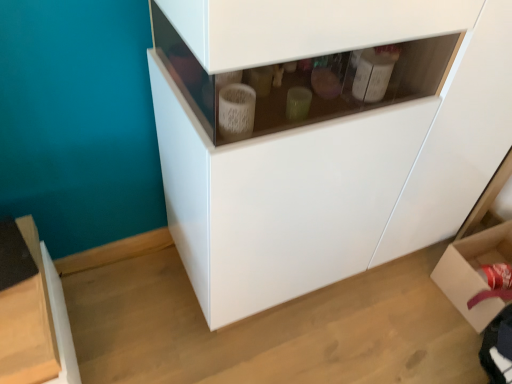
Question: Would you say cardboard box at lower right is inside or outside white glossy cabinet at center?

Choices:
 (A) outside
 (B) inside

Answer: (A)

Question: Is cardboard box at lower right in front of or behind white glossy cabinet at center in the image?

Choices:
 (A) behind
 (B) front

Answer: (A)

Question: In terms of width, does cardboard box at lower right look wider or thinner when compared to white glossy cabinet at center?

Choices:
 (A) thin
 (B) wide

Answer: (A)

Question: Is white glossy cabinet at center bigger or smaller than cardboard box at lower right?

Choices:
 (A) big
 (B) small

Answer: (A)

Question: In terms of height, does white glossy cabinet at center look taller or shorter compared to cardboard box at lower right?

Choices:
 (A) tall
 (B) short

Answer: (A)

Question: Considering the positions of point (505, 142) and point (477, 306), is point (505, 142) closer or farther from the camera than point (477, 306)?

Choices:
 (A) closer
 (B) farther

Answer: (A)

Question: Is white glossy cabinet at center in front of or behind cardboard box at lower right in the image?

Choices:
 (A) front
 (B) behind

Answer: (A)